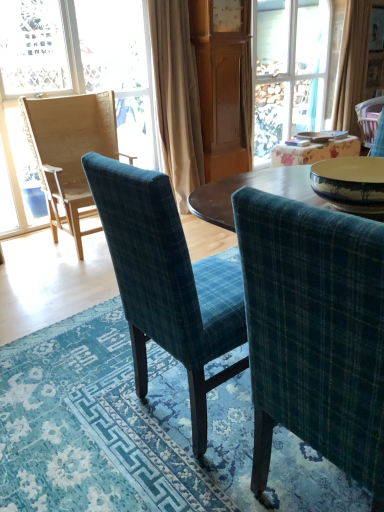
Question: Is transparent glass door at upper center wider than wooden chair at left?

Choices:
 (A) yes
 (B) no

Answer: (A)

Question: Does transparent glass door at upper center have a lesser height compared to wooden chair at left?

Choices:
 (A) no
 (B) yes

Answer: (A)

Question: Is wooden chair at left completely or partially inside transparent glass door at upper center?

Choices:
 (A) yes
 (B) no

Answer: (B)

Question: Does transparent glass door at upper center have a larger size compared to wooden chair at left?

Choices:
 (A) yes
 (B) no

Answer: (A)

Question: Is transparent glass door at upper center turned away from wooden chair at left?

Choices:
 (A) no
 (B) yes

Answer: (A)

Question: From a real-world perspective, is transparent glass door at upper center physically below wooden chair at left?

Choices:
 (A) no
 (B) yes

Answer: (A)

Question: Can you confirm if teal plaid chair at center, the third chair when ordered from right to left, is bigger than beige fabric curtain at center, which is the 2th curtain in back-to-front order?

Choices:
 (A) yes
 (B) no

Answer: (B)

Question: Is teal plaid chair at center, the 2th chair positioned from the left, to the left of beige fabric curtain at center, which is the 2th curtain in back-to-front order, from the viewer's perspective?

Choices:
 (A) yes
 (B) no

Answer: (B)

Question: Is the position of teal plaid chair at center, which is counted as the second chair, starting from the front, less distant than that of beige fabric curtain at center, the second curtain viewed from the right?

Choices:
 (A) yes
 (B) no

Answer: (A)

Question: Is teal plaid chair at center, the 2th chair positioned from the left, beside beige fabric curtain at center, the second curtain viewed from the right?

Choices:
 (A) yes
 (B) no

Answer: (B)

Question: Can you confirm if teal plaid chair at center, the 2th chair positioned from the left, is shorter than beige fabric curtain at center, which is the 2th curtain in back-to-front order?

Choices:
 (A) yes
 (B) no

Answer: (A)

Question: Is teal plaid chair at center, acting as the third chair starting from the back, surrounding beige fabric curtain at center, the second curtain viewed from the right?

Choices:
 (A) yes
 (B) no

Answer: (B)

Question: Is blue textured rug at center beside wooden chair at left?

Choices:
 (A) yes
 (B) no

Answer: (B)